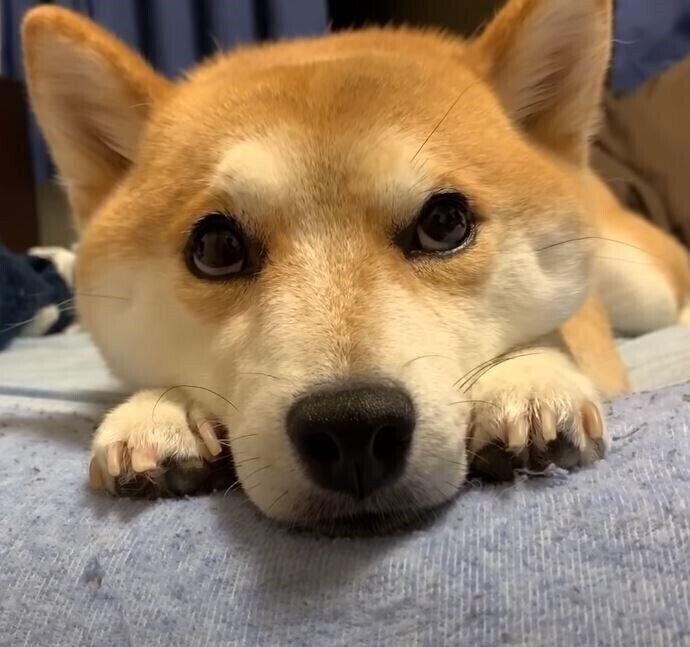
You are a GUI agent. You are given a task and a screenshot of the screen. Output one action in this format:
    pyautogui.click(x=<x>, y=<y>)
    Task: Click on the blue curtain
    
    Given the screenshot: What is the action you would take?
    pyautogui.click(x=288, y=22)